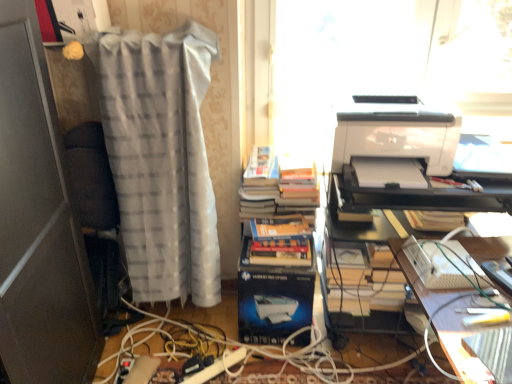
Question: From the image's perspective, would you say hardcover books at center is shown under wooden desk at lower right?

Choices:
 (A) yes
 (B) no

Answer: (B)

Question: Does hardcover books at center appear on the right side of wooden desk at lower right?

Choices:
 (A) yes
 (B) no

Answer: (B)

Question: Can you confirm if hardcover books at center is taller than wooden desk at lower right?

Choices:
 (A) no
 (B) yes

Answer: (A)

Question: Could you tell me if hardcover books at center is turned towards wooden desk at lower right?

Choices:
 (A) no
 (B) yes

Answer: (A)

Question: Does hardcover books at center have a larger size compared to wooden desk at lower right?

Choices:
 (A) yes
 (B) no

Answer: (B)

Question: Is hardcover books at center closer to camera compared to wooden desk at lower right?

Choices:
 (A) yes
 (B) no

Answer: (B)

Question: Does white plastic keyboard at lower right, the first equipment in the left-to-right sequence, come behind white glossy printer at upper right?

Choices:
 (A) no
 (B) yes

Answer: (A)

Question: Can you confirm if white plastic keyboard at lower right, the first equipment in the left-to-right sequence, is shorter than white glossy printer at upper right?

Choices:
 (A) yes
 (B) no

Answer: (A)

Question: Can you confirm if white plastic keyboard at lower right, the first equipment in the left-to-right sequence, is bigger than white glossy printer at upper right?

Choices:
 (A) yes
 (B) no

Answer: (B)

Question: Is white plastic keyboard at lower right, the first equipment in the left-to-right sequence, beside white glossy printer at upper right?

Choices:
 (A) no
 (B) yes

Answer: (A)

Question: Can you confirm if white plastic keyboard at lower right, the first equipment in the left-to-right sequence, is thinner than white glossy printer at upper right?

Choices:
 (A) yes
 (B) no

Answer: (A)

Question: Could you tell me if white plastic keyboard at lower right, the first equipment in the left-to-right sequence, is facing white glossy printer at upper right?

Choices:
 (A) yes
 (B) no

Answer: (B)

Question: Would you say hardcover books at center contains white glossy printer at right?

Choices:
 (A) yes
 (B) no

Answer: (B)